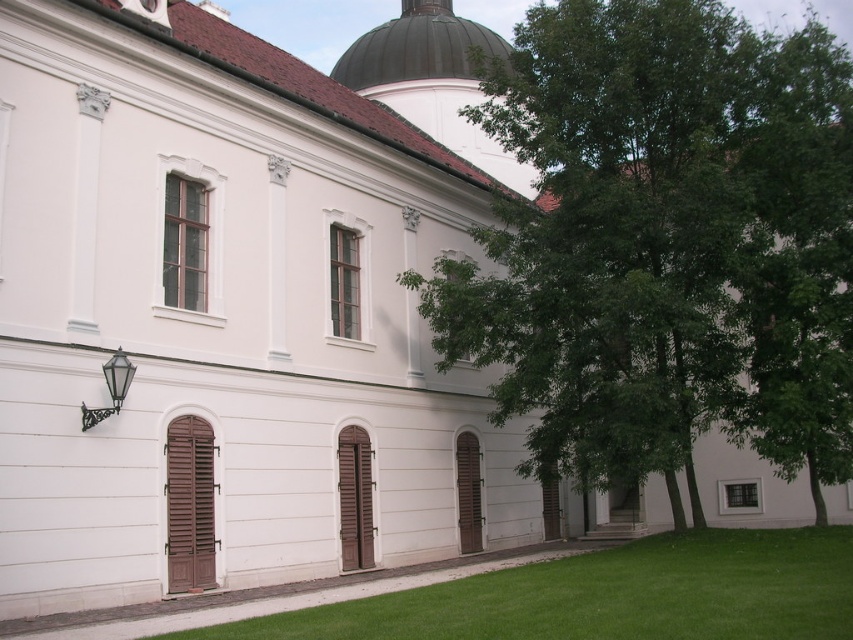
Question: Which point is farther to the camera?

Choices:
 (A) green leafy tree at center
 (B) green grass at lower center

Answer: (A)

Question: Does green leafy tree at center have a lesser width compared to green grass at lower center?

Choices:
 (A) yes
 (B) no

Answer: (B)

Question: Can you confirm if green leafy tree at center is wider than green grass at lower center?

Choices:
 (A) no
 (B) yes

Answer: (B)

Question: Which point is closer to the camera?

Choices:
 (A) green grass at lower center
 (B) green leafy tree at center

Answer: (A)

Question: Is green leafy tree at center positioned in front of green grass at lower center?

Choices:
 (A) no
 (B) yes

Answer: (A)